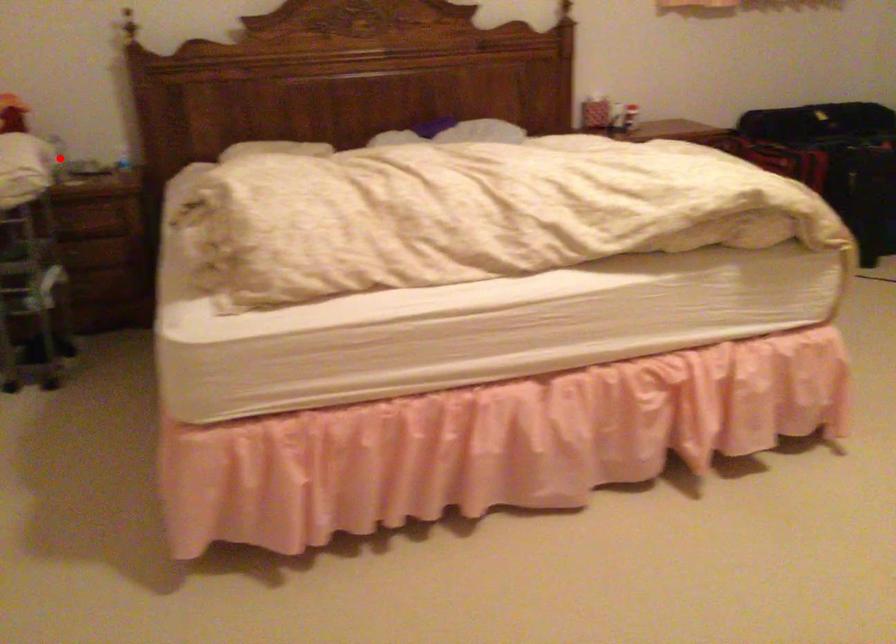
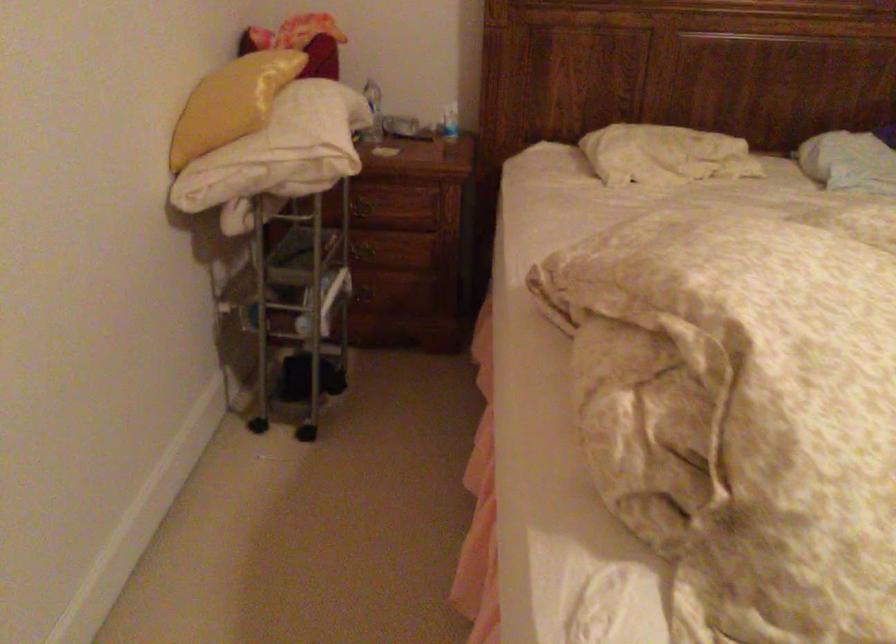
Question: I am providing you with two images of the same scene from different viewpoints. A red point is marked on the first image. At the location where the point appears in image 1, is it still visible in image 2?

Choices:
 (A) Yes
 (B) No

Answer: (B)